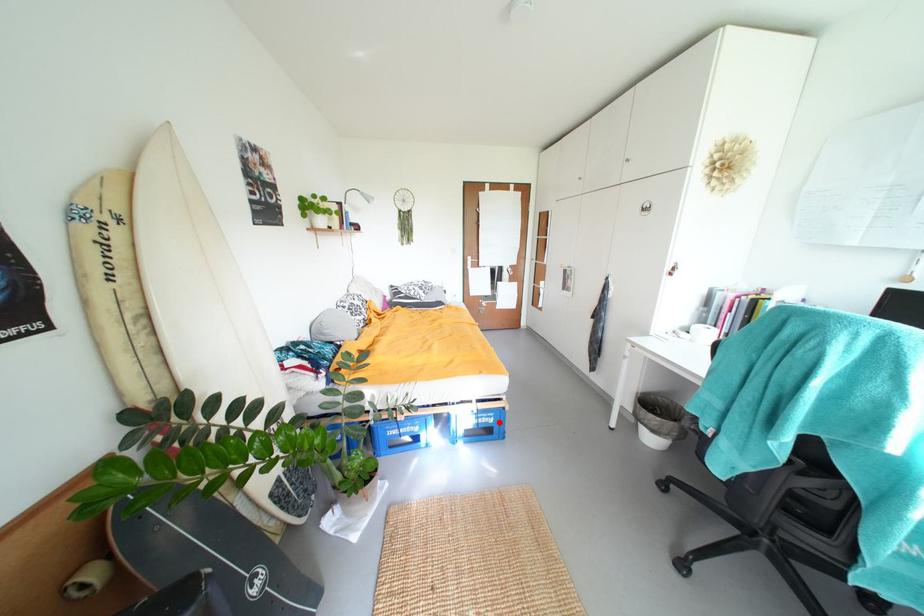
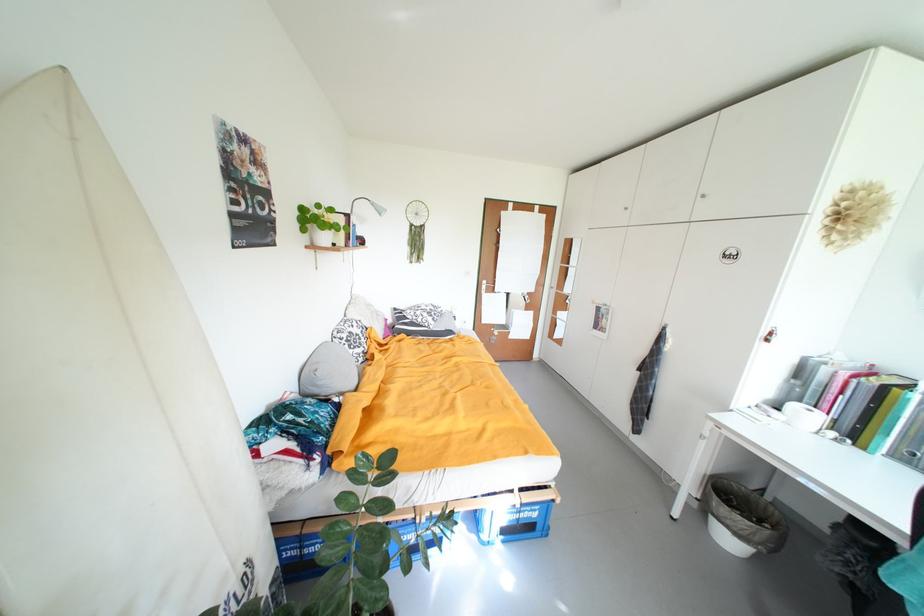
Find the pixel in the second image that matches the highlighted location in the first image.

(543, 517)